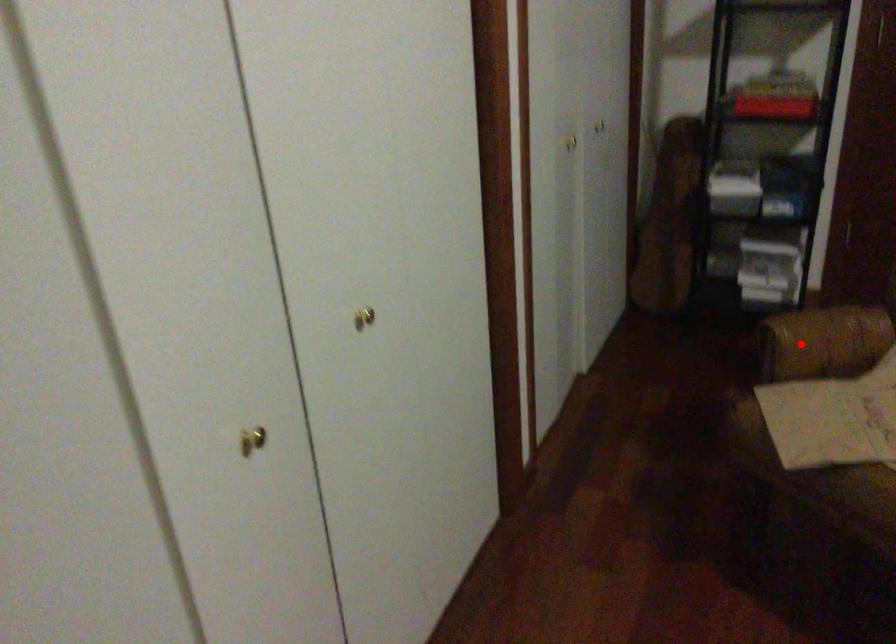
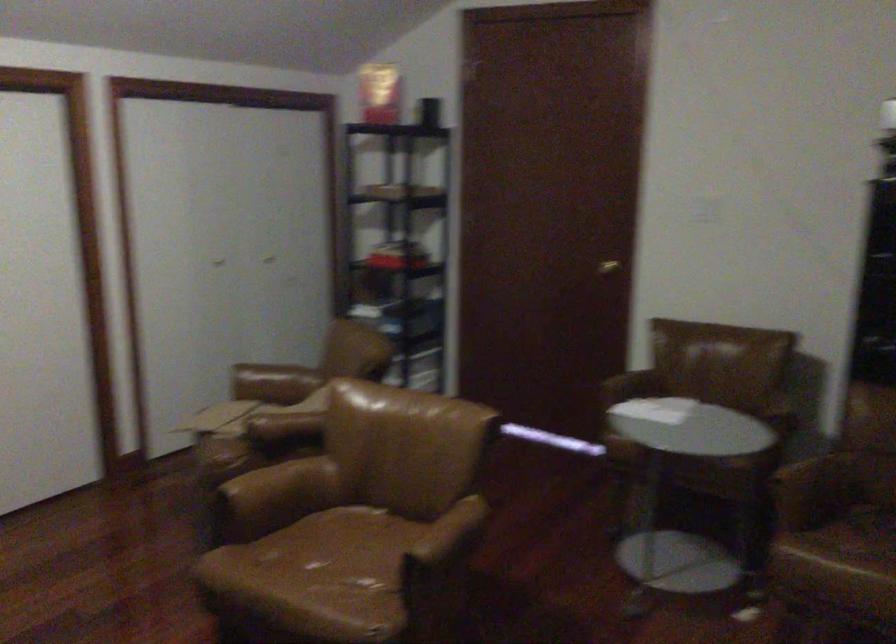
Question: I am providing you with two images of the same scene from different viewpoints. Image1 has a red point marked. In image2, the corresponding 3D location appears at what relative position? Reply with the corresponding letter.

Choices:
 (A) Closer
 (B) Farther

Answer: (B)